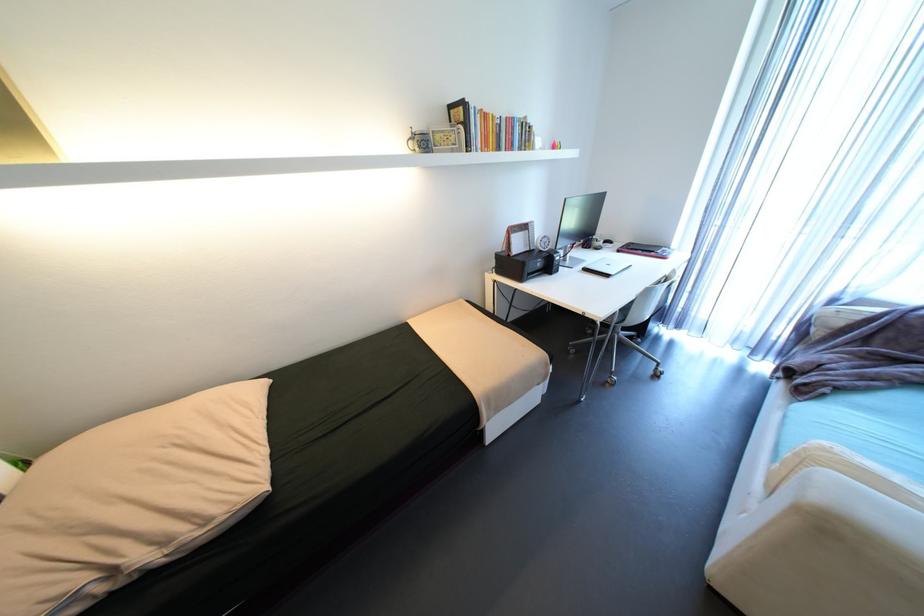
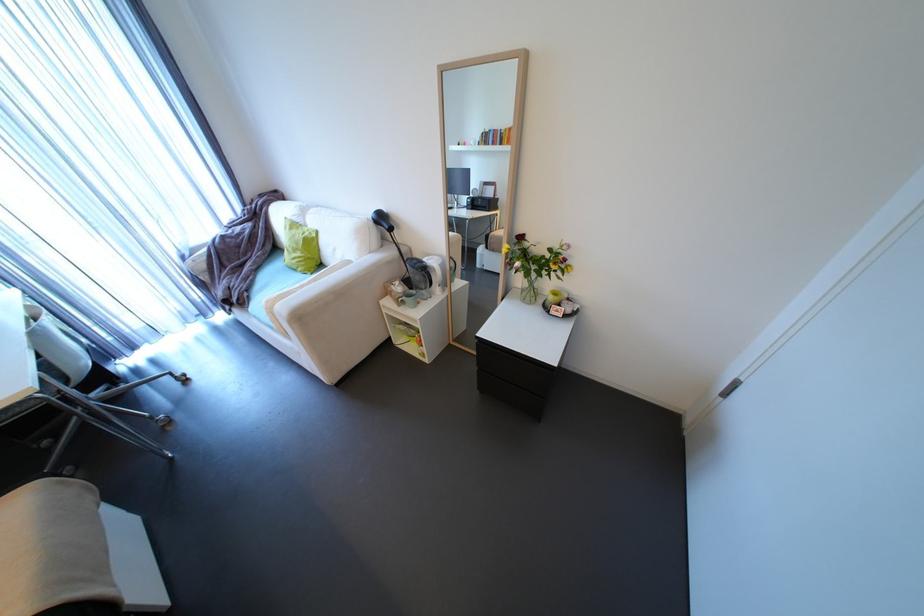
In the second image, find the point that corresponds to (809,389) in the first image.

(248, 302)